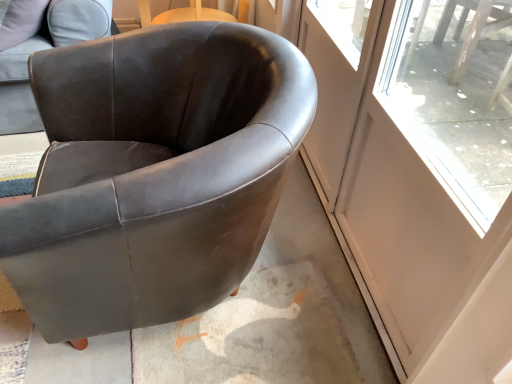
Question: From the image's perspective, is matte black armchair at center, the first chair in the right-to-left sequence, above or below transparent glass screen door at right, the first screen door in the right-to-left sequence?

Choices:
 (A) above
 (B) below

Answer: (A)

Question: Is point (104, 122) positioned closer to the camera than point (430, 278)?

Choices:
 (A) farther
 (B) closer

Answer: (A)

Question: Considering the real-world distances, which object is closest to the matte black armchair at center, the first chair in the right-to-left sequence?

Choices:
 (A) transparent glass screen door at right, which appears as the 2th screen door when viewed from the left
 (B) clear glass screen door at upper right, marked as the 1th screen door in a left-to-right arrangement
 (C) suede-like brown armchair at upper left, arranged as the 2th chair when viewed from the right

Answer: (B)

Question: Based on their relative distances, which object is farther from the clear glass screen door at upper right, marked as the 1th screen door in a left-to-right arrangement?

Choices:
 (A) suede-like brown armchair at upper left, arranged as the 2th chair when viewed from the right
 (B) transparent glass screen door at right, the first screen door in the right-to-left sequence
 (C) matte black armchair at center, the first chair in the right-to-left sequence

Answer: (A)